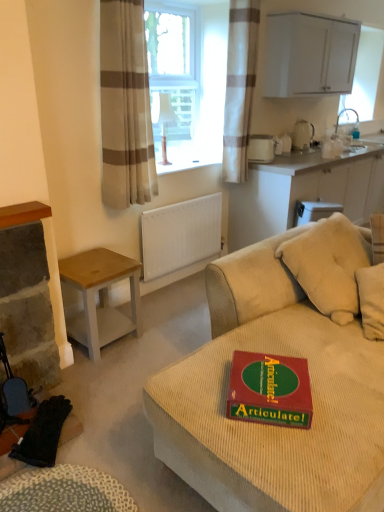
The width and height of the screenshot is (384, 512). I want to click on free space in front of light brown wood desk at left, so click(105, 372).